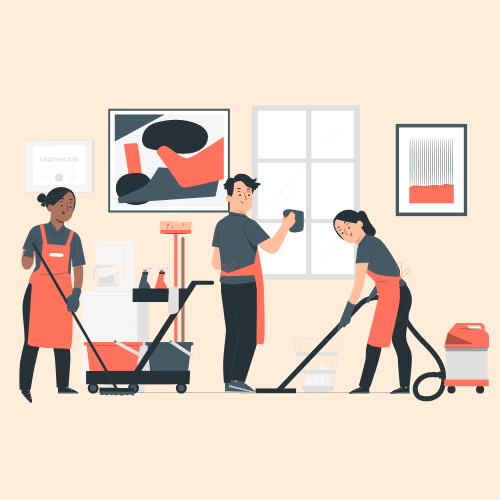
I want to click on towel, so pos(173,297).